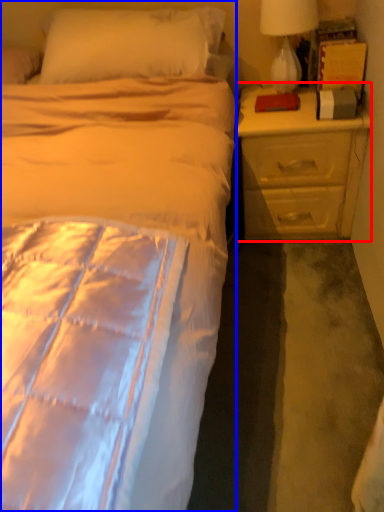
Question: Which object appears farthest to the camera in this image, nightstand (highlighted by a red box) or bed (highlighted by a blue box)?

Choices:
 (A) nightstand
 (B) bed

Answer: (A)